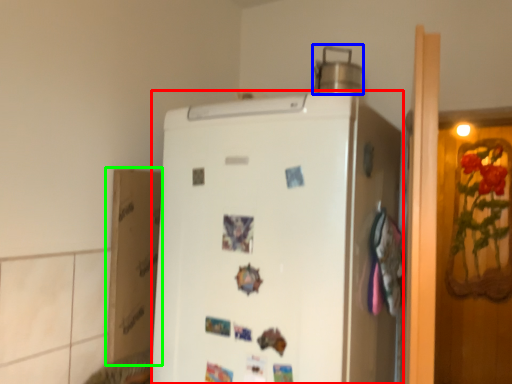
Question: Considering the real-world distances, which object is closest to refrigerator (highlighted by a red box)? appliance (highlighted by a blue box) or cardboard box (highlighted by a green box).

Choices:
 (A) appliance
 (B) cardboard box

Answer: (B)